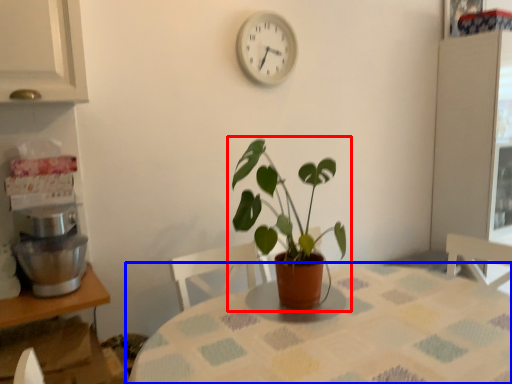
Question: Which of the following is the closest to the observer, houseplant (highlighted by a red box) or table (highlighted by a blue box)?

Choices:
 (A) houseplant
 (B) table

Answer: (B)